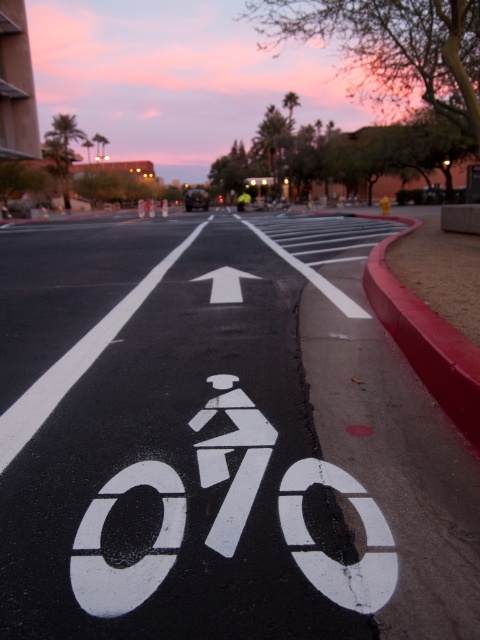
Question: In this image, where is white matte bicycle symbol at center located relative to red rubber curb at right?

Choices:
 (A) above
 (B) below

Answer: (B)

Question: Which point is closer to the camera?

Choices:
 (A) white painted bike lane at center
 (B) red rubber curb at right

Answer: (A)

Question: Which point appears closest to the camera in this image?

Choices:
 (A) (202, 422)
 (B) (296, 525)

Answer: (B)

Question: Can you confirm if white painted bike lane at center is smaller than red rubber curb at right?

Choices:
 (A) no
 (B) yes

Answer: (B)

Question: Which object appears closest to the camera in this image?

Choices:
 (A) red rubber curb at right
 (B) white matte arrow at center

Answer: (A)

Question: Is white painted bike lane at center below white matte bicycle symbol at center?

Choices:
 (A) no
 (B) yes

Answer: (A)